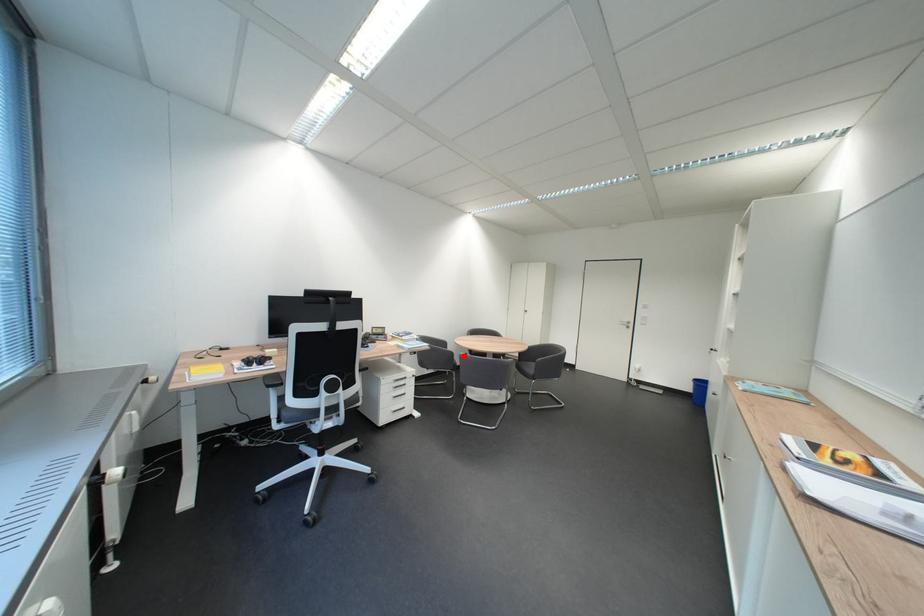
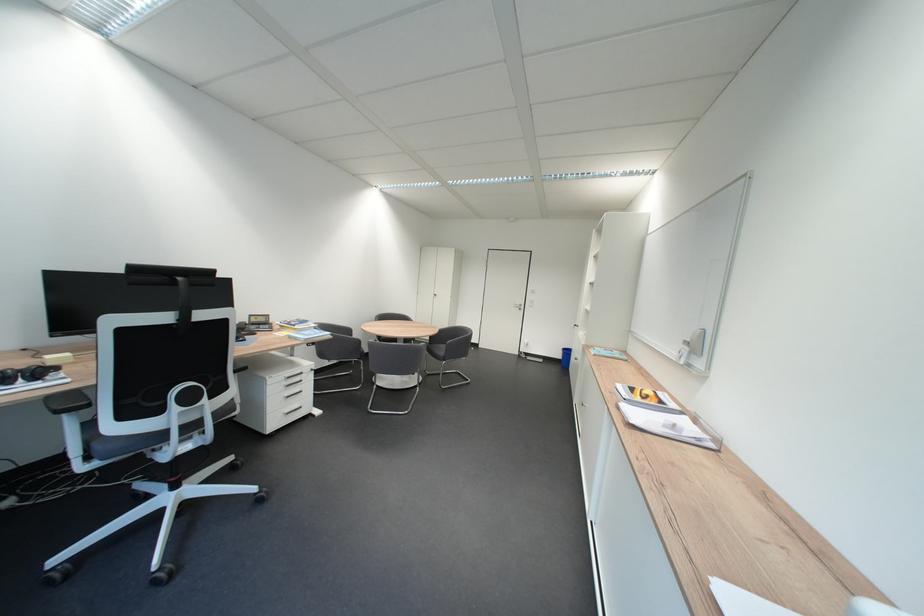
Question: I am providing you with two images of the same scene from different viewpoints. Given a red point in image1, look at the same physical point in image2. Is it:

Choices:
 (A) Closer to the viewpoint
 (B) Farther from the viewpoint

Answer: (B)